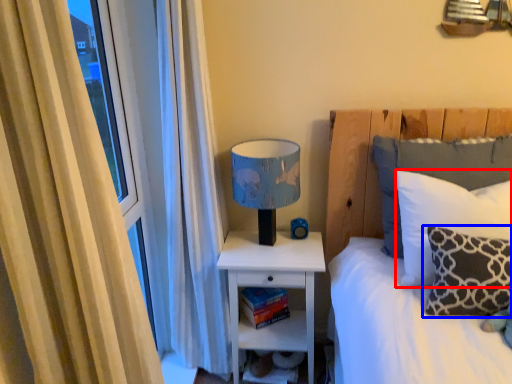
Question: Among these objects, which one is farthest to the camera, pillow (highlighted by a red box) or pillow (highlighted by a blue box)?

Choices:
 (A) pillow
 (B) pillow

Answer: (A)